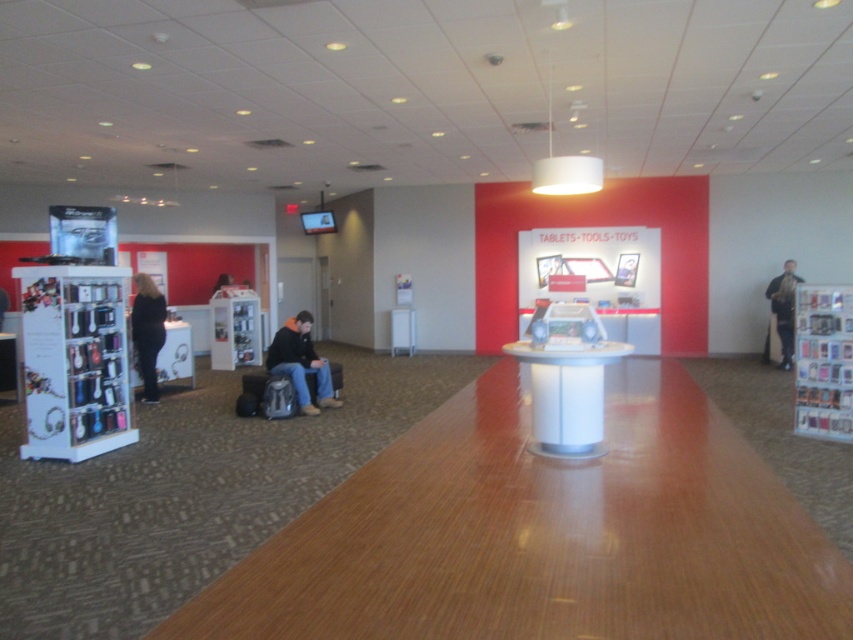
Which is behind, point (277, 360) or point (160, 337)?

The point (160, 337) is more distant.

Is dark blue jeans at center bigger than black fabric pants at left?

No.

Where is `dark blue jeans at center`? dark blue jeans at center is located at coordinates (300, 364).

Where is `dark blue jeans at center`? dark blue jeans at center is located at coordinates (300, 364).

Is point (281, 356) positioned in front of point (782, 291)?

Yes, point (281, 356) is closer to viewer.

Is dark blue jeans at center shorter than dark blue jeans at center right?

Correct, dark blue jeans at center is not as tall as dark blue jeans at center right.

Where is `dark blue jeans at center`? The height and width of the screenshot is (640, 853). dark blue jeans at center is located at coordinates (300, 364).

Is dark blue jeans at center right above black leather jacket at upper center?

No, dark blue jeans at center right is not above black leather jacket at upper center.

You are a GUI agent. You are given a task and a screenshot of the screen. Output one action in this format:
    pyautogui.click(x=<x>, y=<y>)
    Task: Click on the dark blue jeans at center right
    The image size is (853, 640).
    Given the screenshot: What is the action you would take?
    pyautogui.click(x=782, y=308)